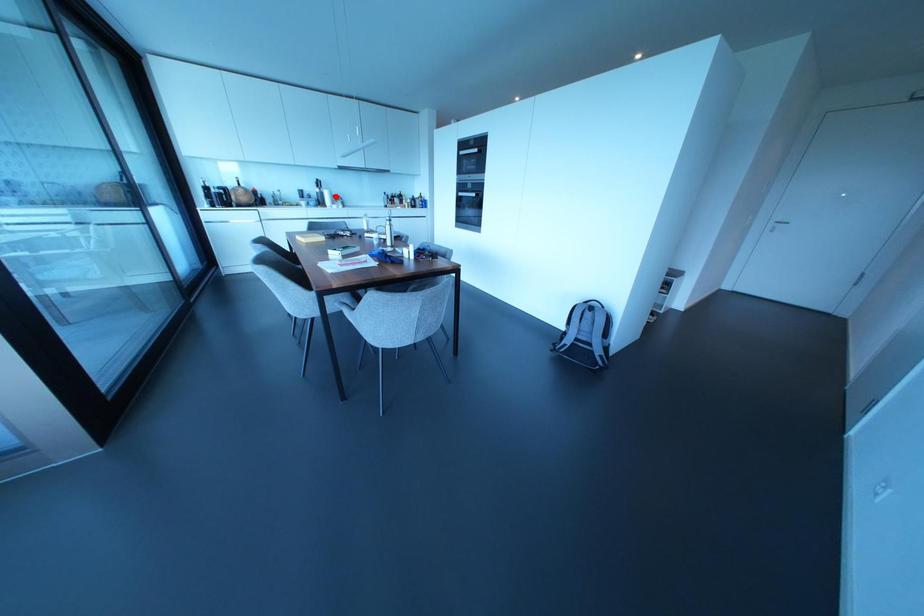
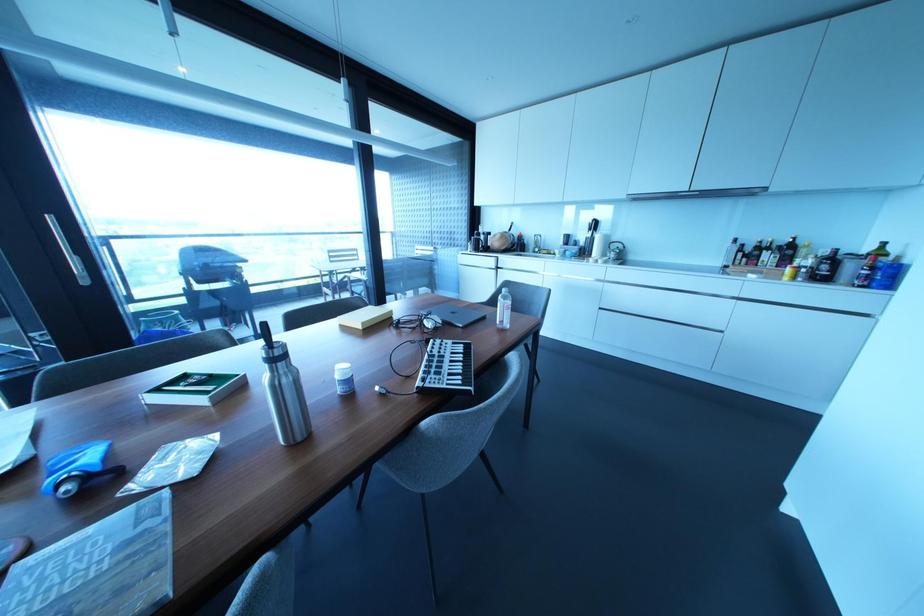
The point at the highlighted location is marked in the first image. Where is the corresponding point in the second image?

(614, 245)